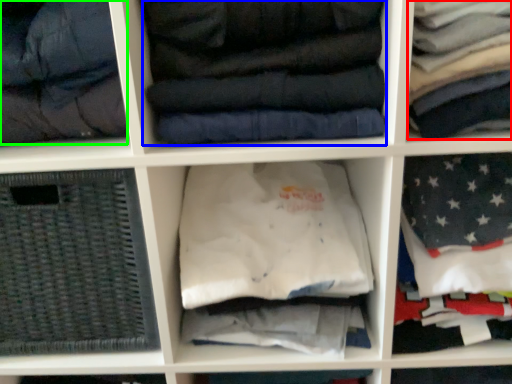
Question: Estimate the real-world distances between objects in this image. Which object is closer to clothing (highlighted by a red box), clothing (highlighted by a blue box) or garment (highlighted by a green box)?

Choices:
 (A) clothing
 (B) garment

Answer: (A)